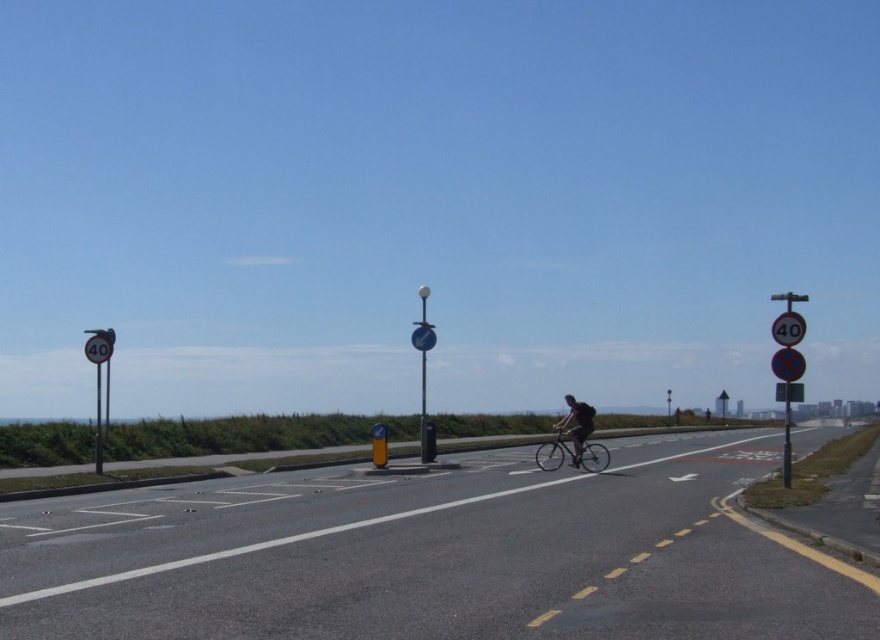
Can you confirm if shiny metallic bicycle at center is wider than metallic circular sign at right?

Correct, the width of shiny metallic bicycle at center exceeds that of metallic circular sign at right.

Which is more to the left, shiny metallic bicycle at center or metallic circular sign at right?

Positioned to the left is shiny metallic bicycle at center.

Between point (589, 461) and point (790, 333), which one is positioned in front?

Positioned in front is point (790, 333).

This screenshot has height=640, width=880. In order to click on shiny metallic bicycle at center in this screenshot , I will do `click(572, 452)`.

Looking at this image, how far apart are asphalt road at center and metallic circular sign at right?

8.17 meters

Between asphalt road at center and metallic circular sign at right, which one is positioned higher?

metallic circular sign at right is above.

Does point (375, 540) come in front of point (802, 317)?

Yes, it is.

Identify the location of asphalt road at center. (435, 557).

Between point (362, 566) and point (103, 346), which one is positioned behind?

Point (103, 346)

Between asphalt road at center and metallic circular sign at left, which one has less height?

metallic circular sign at left is shorter.

Is point (290, 614) positioned after point (86, 356)?

No, it is not.

This screenshot has width=880, height=640. In order to click on asphalt road at center in this screenshot , I will do `click(435, 557)`.